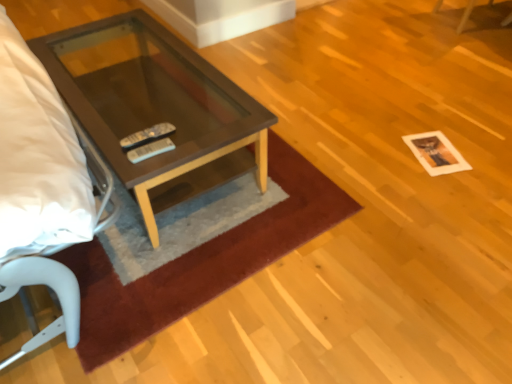
Locate an element on the screen. vacant space to the left of white paper at lower right is located at coordinates (383, 153).